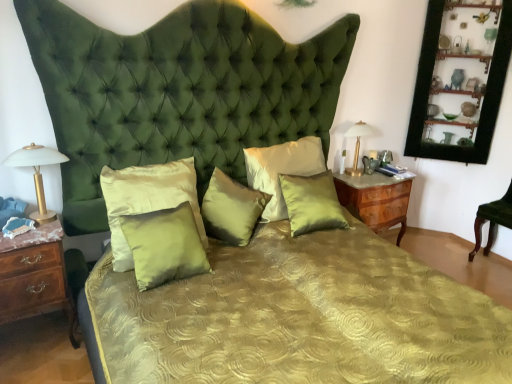
Question: Is satin/velvet pillow at center, acting as the fifth pillow starting from the right, positioned before gold metallic lamp at right, which is the second bedside lamp from front to back?

Choices:
 (A) yes
 (B) no

Answer: (A)

Question: From the image's perspective, is satin/velvet pillow at center, acting as the fifth pillow starting from the right, on gold metallic lamp at right, acting as the 1th bedside lamp starting from the right?

Choices:
 (A) yes
 (B) no

Answer: (B)

Question: Are satin/velvet pillow at center, acting as the fifth pillow starting from the right, and gold metallic lamp at right, the 2th bedside lamp when ordered from left to right, located far from each other?

Choices:
 (A) no
 (B) yes

Answer: (B)

Question: Are satin/velvet pillow at center, which is counted as the first pillow, starting from the left, and gold metallic lamp at right, the 2th bedside lamp when ordered from left to right, beside each other?

Choices:
 (A) yes
 (B) no

Answer: (B)

Question: From a real-world perspective, is satin/velvet pillow at center, which is counted as the first pillow, starting from the left, located beneath gold metallic lamp at right, the 2th bedside lamp when ordered from left to right?

Choices:
 (A) yes
 (B) no

Answer: (A)

Question: From the image's perspective, is satin/velvet pillow at center, acting as the fifth pillow starting from the right, below gold metallic lamp at right, positioned as the first bedside lamp in back-to-front order?

Choices:
 (A) yes
 (B) no

Answer: (A)

Question: Is satin green pillow at center, the third pillow in the left-to-right sequence, to the right of satin green pillow at center, acting as the second pillow starting from the right, from the viewer's perspective?

Choices:
 (A) no
 (B) yes

Answer: (A)

Question: From a real-world perspective, is satin green pillow at center, the third pillow in the left-to-right sequence, positioned under satin green pillow at center, acting as the second pillow starting from the right, based on gravity?

Choices:
 (A) yes
 (B) no

Answer: (A)

Question: From the image's perspective, is satin green pillow at center, the third pillow in the left-to-right sequence, beneath satin green pillow at center, acting as the second pillow starting from the right?

Choices:
 (A) no
 (B) yes

Answer: (B)

Question: Are satin green pillow at center, the third pillow in the left-to-right sequence, and satin green pillow at center, acting as the second pillow starting from the right, making contact?

Choices:
 (A) no
 (B) yes

Answer: (A)

Question: From a real-world perspective, is satin green pillow at center, positioned as the third pillow in right-to-left order, located higher than satin green pillow at center, arranged as the 4th pillow when viewed from the left?

Choices:
 (A) no
 (B) yes

Answer: (A)

Question: Is satin green pillow at center, positioned as the third pillow in right-to-left order, not inside satin green pillow at center, acting as the second pillow starting from the right?

Choices:
 (A) yes
 (B) no

Answer: (A)

Question: Does black wood picture frame at upper right have a lesser width compared to satin green pillow at center, which appears as the fifth pillow when viewed from the left?

Choices:
 (A) yes
 (B) no

Answer: (B)